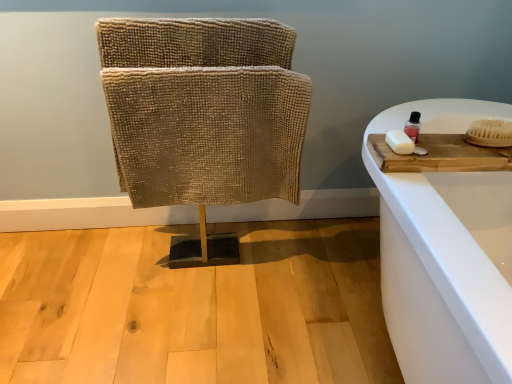
You are a GUI agent. You are given a task and a screenshot of the screen. Output one action in this format:
    pyautogui.click(x=<x>, y=<y>)
    Task: Click on the vacant area located to the right-hand side of beige textured fabric at center
    
    Given the screenshot: What is the action you would take?
    pyautogui.click(x=322, y=267)